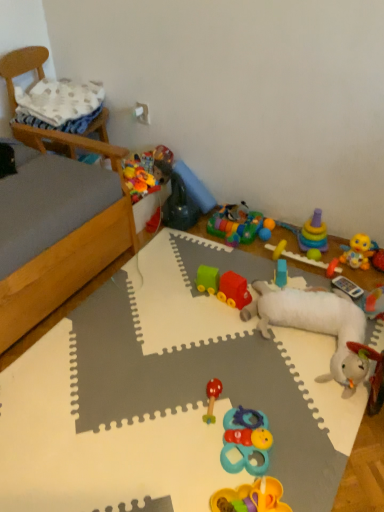
The height and width of the screenshot is (512, 384). Identify the location of vacant area that lies between rubberized plastic train at center, which is counted as the 4th toy, starting from the bottom, and blue rubber teething ring at center, positioned as the first toy in bottom-to-top order. (235, 352).